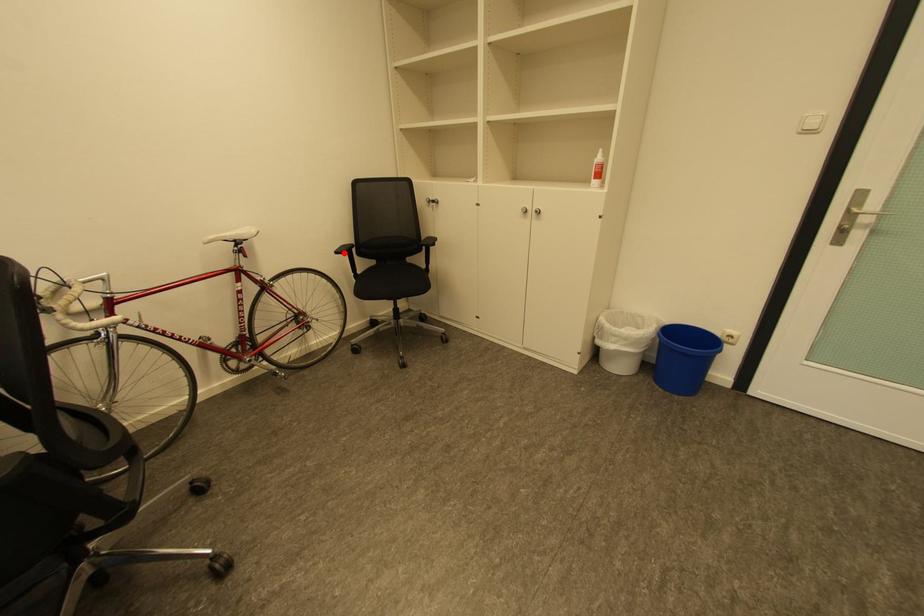
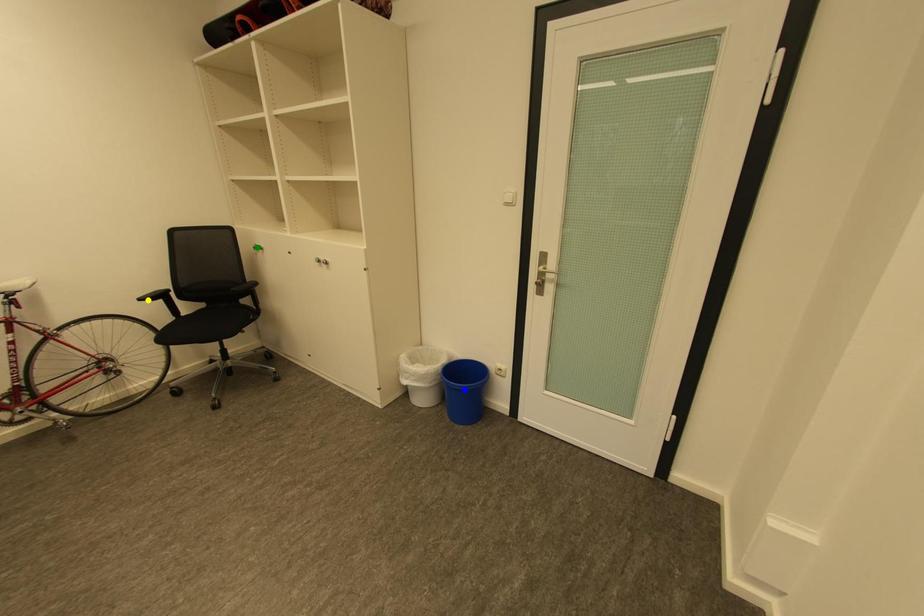
Question: I am providing you with two images of the same scene from different viewpoints. A red point is marked on the first image. You are given multiple points on the second image. Can you choose the point in image 2 that corresponds to the point in image 1?

Choices:
 (A) blue point
 (B) green point
 (C) yellow point

Answer: (C)